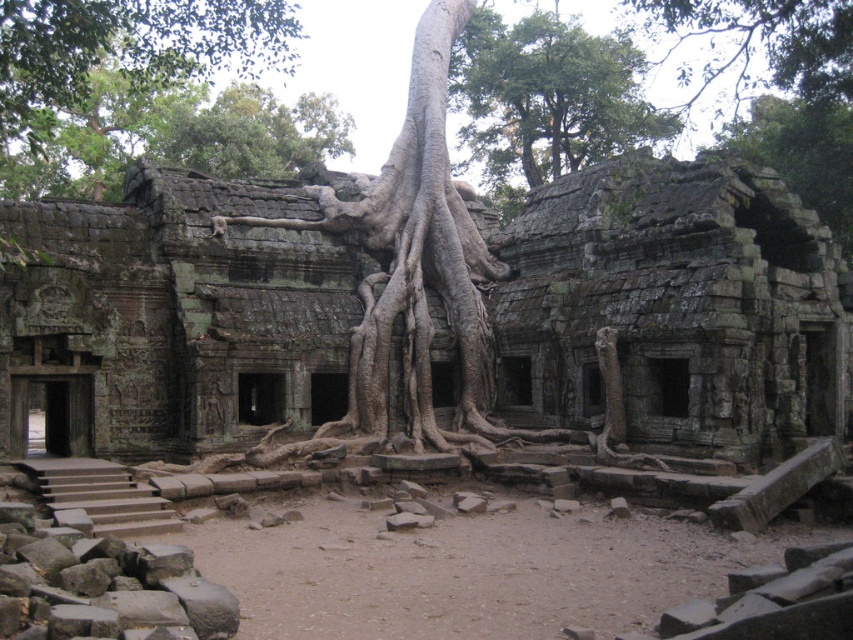
Is gray rough stone tree trunk at center thinner than green leafy tree at upper center?

Yes.

Who is positioned more to the right, gray rough stone tree trunk at center or green leafy tree at upper center?

Positioned to the right is green leafy tree at upper center.

Which is in front, point (392, 280) or point (503, 104)?

Point (392, 280) is in front.

Identify the location of gray rough stone tree trunk at center. The height and width of the screenshot is (640, 853). [421, 259].

Between point (611, 145) and point (834, 150), which one is positioned in front?

Point (834, 150) is in front.

From the picture: Is green leafy tree at upper center further to camera compared to green mossy roots at upper right?

Yes, it is.

Find the location of a particular element. This screenshot has height=640, width=853. green leafy tree at upper center is located at coordinates (548, 97).

Locate an element on the screen. Image resolution: width=853 pixels, height=640 pixels. green leafy tree at upper center is located at coordinates (548, 97).

Who is shorter, gray stone ruins at center or green leafy tree at upper center?

gray stone ruins at center is shorter.

The height and width of the screenshot is (640, 853). In order to click on gray stone ruins at center in this screenshot , I will do `click(674, 308)`.

Find the location of `gray stone ruins at center`. gray stone ruins at center is located at coordinates (674, 308).